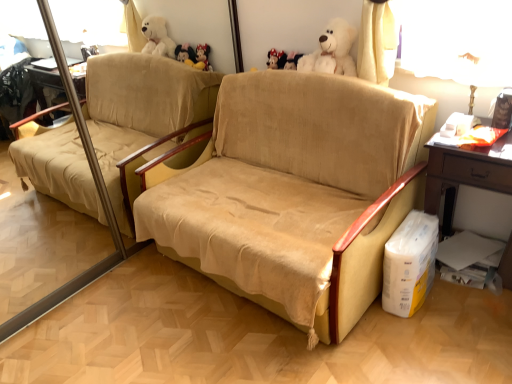
Question: Can you confirm if white cardboard box at lower right is thinner than metallic gold table lamp at upper right?

Choices:
 (A) yes
 (B) no

Answer: (B)

Question: Does white cardboard box at lower right have a lesser height compared to metallic gold table lamp at upper right?

Choices:
 (A) yes
 (B) no

Answer: (A)

Question: From a real-world perspective, is white cardboard box at lower right on top of metallic gold table lamp at upper right?

Choices:
 (A) yes
 (B) no

Answer: (B)

Question: Is white cardboard box at lower right at the right side of metallic gold table lamp at upper right?

Choices:
 (A) yes
 (B) no

Answer: (B)

Question: Is white cardboard box at lower right to the left of metallic gold table lamp at upper right from the viewer's perspective?

Choices:
 (A) yes
 (B) no

Answer: (A)

Question: Is white cardboard box at lower right far away from metallic gold table lamp at upper right?

Choices:
 (A) yes
 (B) no

Answer: (B)

Question: Can you confirm if white cardboard box at lower right is smaller than fluffy white teddy bear at upper center?

Choices:
 (A) no
 (B) yes

Answer: (B)

Question: Is white cardboard box at lower right placed right next to fluffy white teddy bear at upper center?

Choices:
 (A) yes
 (B) no

Answer: (B)

Question: Is the depth of white cardboard box at lower right greater than that of fluffy white teddy bear at upper center?

Choices:
 (A) yes
 (B) no

Answer: (B)

Question: Can you confirm if white cardboard box at lower right is taller than fluffy white teddy bear at upper center?

Choices:
 (A) yes
 (B) no

Answer: (A)

Question: From the image's perspective, would you say white cardboard box at lower right is positioned over fluffy white teddy bear at upper center?

Choices:
 (A) no
 (B) yes

Answer: (A)

Question: Does white cardboard box at lower right have a greater width compared to fluffy white teddy bear at upper center?

Choices:
 (A) no
 (B) yes

Answer: (B)

Question: Can you confirm if beige suede couch at center is shorter than metallic gold table lamp at upper right?

Choices:
 (A) yes
 (B) no

Answer: (B)